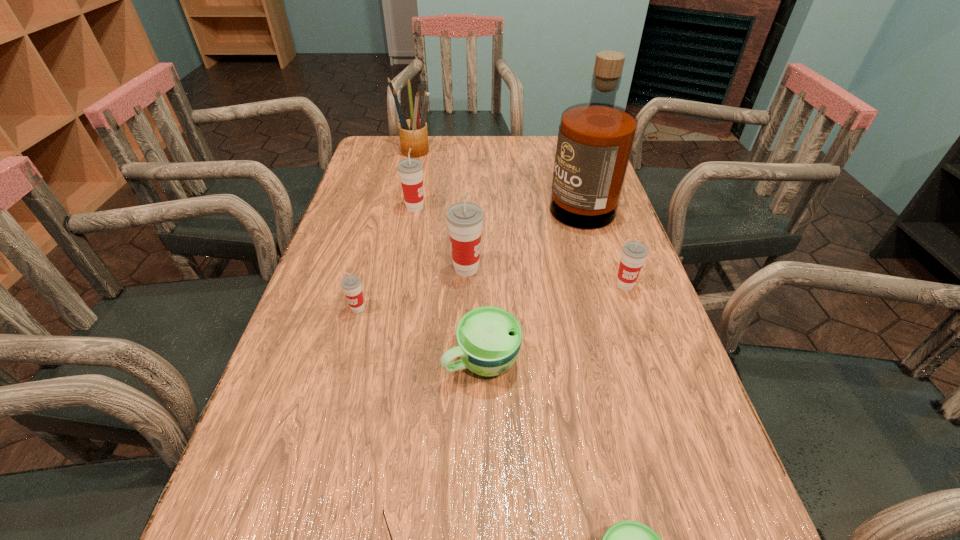
Identify which object is the fourth nearest to the fourth nearest object. Please provide its 2D coordinates. Your answer should be formatted as a tuple, i.e. [(x, y)], where the tuple contains the x and y coordinates of a point satisfying the conditions above.

[(383, 510)]

Where is `cup that is the nearest to the leftmost cup`? cup that is the nearest to the leftmost cup is located at coordinates (489, 338).

The height and width of the screenshot is (540, 960). I want to click on cup that can be found as the fourth closest to the fourth tallest cup, so click(634, 253).

The width and height of the screenshot is (960, 540). I want to click on red cup that is the second closest to the second cup from right to left, so click(465, 219).

This screenshot has width=960, height=540. Identify the location of red cup identified as the third closest to the spectacles. (634, 253).